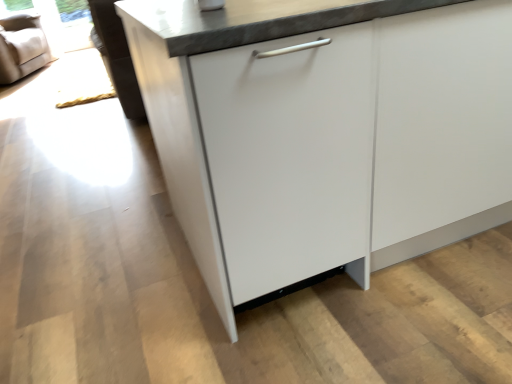
Question: Does beige fabric armchair at upper left have a lesser width compared to transparent glass window screen at upper left?

Choices:
 (A) yes
 (B) no

Answer: (B)

Question: From a real-world perspective, is beige fabric armchair at upper left below transparent glass window screen at upper left?

Choices:
 (A) yes
 (B) no

Answer: (B)

Question: Is beige fabric armchair at upper left not close to transparent glass window screen at upper left?

Choices:
 (A) yes
 (B) no

Answer: (B)

Question: From the image's perspective, does beige fabric armchair at upper left appear lower than transparent glass window screen at upper left?

Choices:
 (A) no
 (B) yes

Answer: (B)

Question: Does beige fabric armchair at upper left touch transparent glass window screen at upper left?

Choices:
 (A) yes
 (B) no

Answer: (B)

Question: From the image's perspective, relative to beige fabric armchair at upper left, is white glossy cabinet at center above or below?

Choices:
 (A) below
 (B) above

Answer: (A)

Question: Considering the positions of point (182, 3) and point (27, 18), is point (182, 3) closer or farther from the camera than point (27, 18)?

Choices:
 (A) closer
 (B) farther

Answer: (A)

Question: Considering their positions, is white glossy cabinet at center located in front of or behind beige fabric armchair at upper left?

Choices:
 (A) behind
 (B) front

Answer: (B)

Question: Considering the positions of white glossy cabinet at center and beige fabric armchair at upper left in the image, is white glossy cabinet at center wider or thinner than beige fabric armchair at upper left?

Choices:
 (A) wide
 (B) thin

Answer: (A)

Question: Based on their sizes in the image, would you say transparent glass window screen at upper left is bigger or smaller than beige fabric armchair at upper left?

Choices:
 (A) small
 (B) big

Answer: (A)

Question: From the image's perspective, is transparent glass window screen at upper left above or below beige fabric armchair at upper left?

Choices:
 (A) above
 (B) below

Answer: (A)

Question: Considering their positions, is transparent glass window screen at upper left located in front of or behind beige fabric armchair at upper left?

Choices:
 (A) behind
 (B) front

Answer: (A)

Question: Would you say transparent glass window screen at upper left is inside or outside beige fabric armchair at upper left?

Choices:
 (A) outside
 (B) inside

Answer: (A)

Question: Would you say white glossy cabinet at center is inside or outside transparent glass window screen at upper left?

Choices:
 (A) inside
 (B) outside

Answer: (B)

Question: Is point (434, 61) closer or farther from the camera than point (82, 21)?

Choices:
 (A) farther
 (B) closer

Answer: (B)